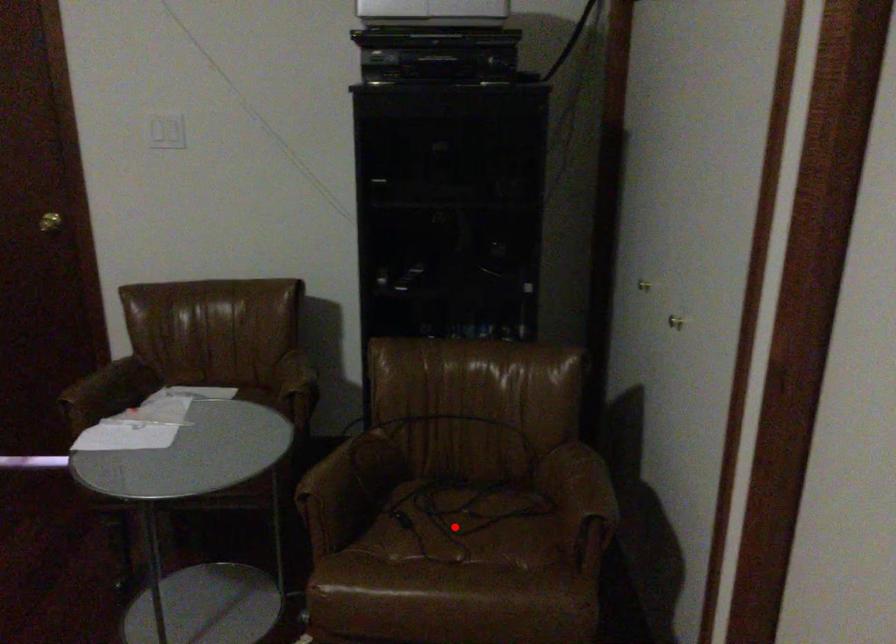
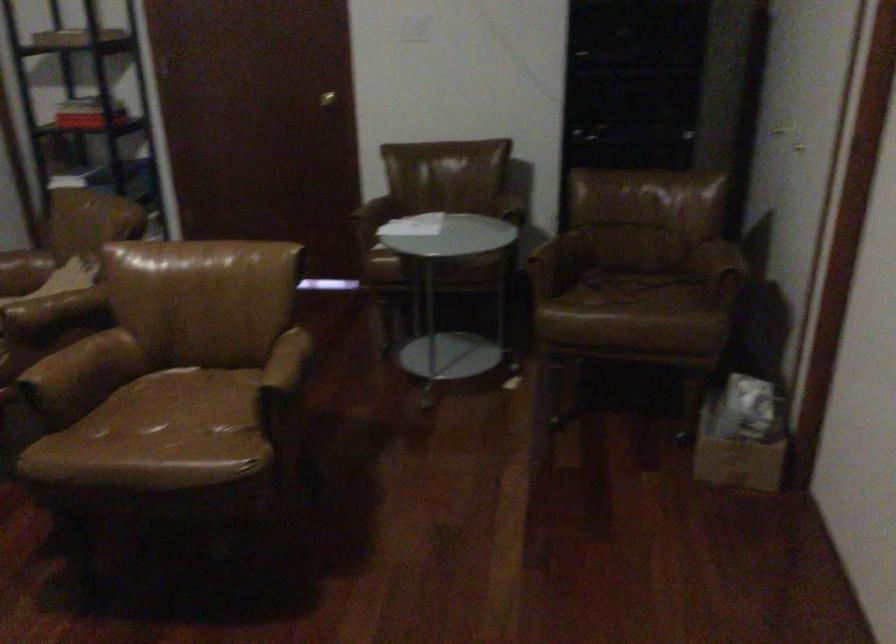
The point at the highlighted location is marked in the first image. Where is the corresponding point in the second image?

(627, 288)